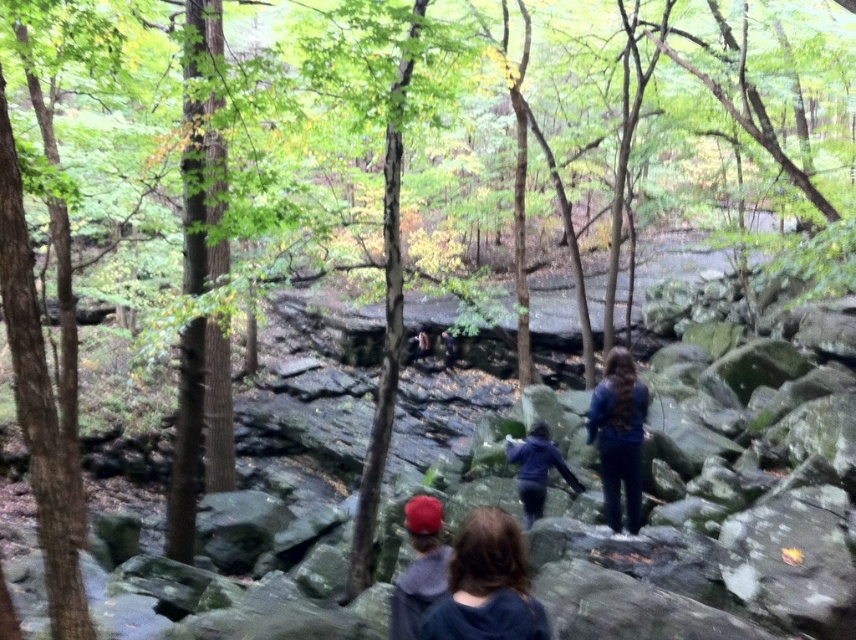
You are a hiker carrying a 2.5 meter long tent pole. You see the blue fabric at center and the red fabric cap at lower center. Can you fit the tent pole between them without bending it?

The distance between the blue fabric at center and the red fabric cap at lower center is 3.64 meters, which is longer than the tent pole. So yes, the tent pole can be placed between them without bending.

You are a hiker navigating through the forest and want to reach the point marked at coordinates point [420,545]. There is another point at point [530,474] in your path. Which point should you reach first to stay on the correct path?

You should reach point [420,545] first because it is in front of point [530,474], so following that order keeps you on the correct path.

You are a hiker trying to locate two items in the forest scene. You see the red fabric cap at lower center and the dark blue jacket at center. Which item is closer to you, the observer?

The red fabric cap at lower center is closer to you because it is in front of the dark blue jacket at center.